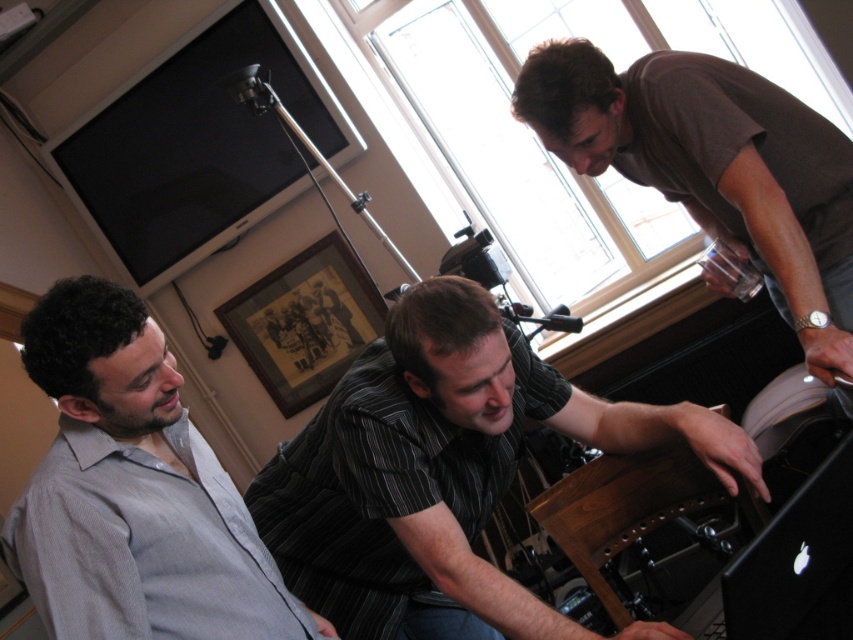
Question: Does brown cotton shirt at upper right have a smaller size compared to black glossy laptop at lower right?

Choices:
 (A) no
 (B) yes

Answer: (A)

Question: Which of the following is the closest to the observer?

Choices:
 (A) (828, 625)
 (B) (613, 412)

Answer: (A)

Question: Does brown cotton shirt at upper right have a lesser width compared to black glossy laptop at lower right?

Choices:
 (A) no
 (B) yes

Answer: (A)

Question: Which object is the closest to the black glossy laptop at lower right?

Choices:
 (A) striped cotton shirt at center
 (B) brown cotton shirt at upper right

Answer: (A)

Question: Estimate the real-world distances between objects in this image. Which object is farther from the striped cotton shirt at center?

Choices:
 (A) gray striped shirt at left
 (B) black glossy laptop at lower right

Answer: (B)

Question: Is striped cotton shirt at center above gray striped shirt at left?

Choices:
 (A) yes
 (B) no

Answer: (A)